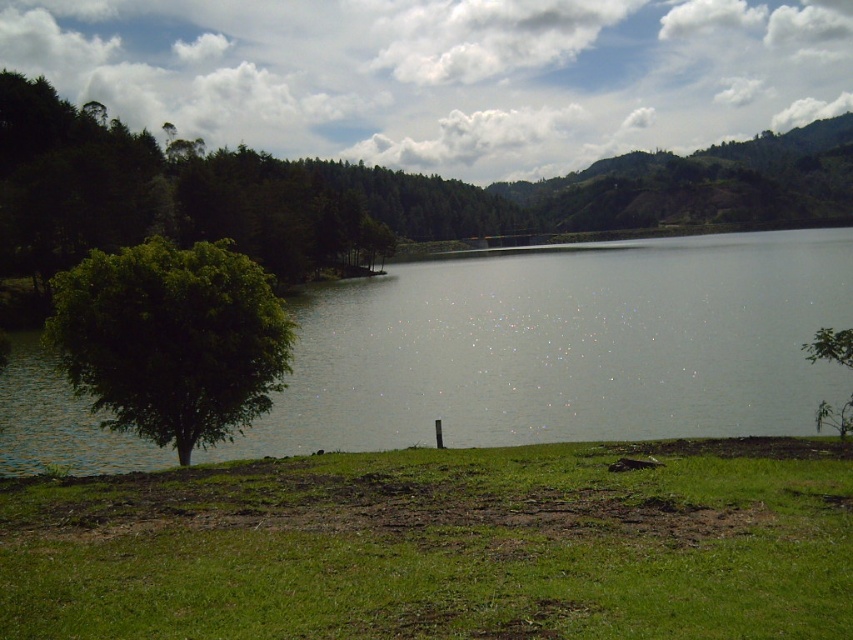
Is green leafy tree at left above green leafy tree at lower right?

Indeed, green leafy tree at left is positioned over green leafy tree at lower right.

Between green leafy tree at left and green leafy tree at lower right, which one has more height?

With more height is green leafy tree at left.

Looking at this image, who is more forward, (254, 358) or (825, 360)?

Point (825, 360) is more forward.

At what (x,y) coordinates should I click in order to perform the action: click on green leafy tree at left. Please return your answer as a coordinate pair (x, y). This screenshot has height=640, width=853. Looking at the image, I should click on (171, 340).

In the scene shown: Is green grassy at lower center to the right of green leafy tree at left from the viewer's perspective?

Correct, you'll find green grassy at lower center to the right of green leafy tree at left.

Does green grassy at lower center appear under green leafy tree at left?

Correct, green grassy at lower center is located below green leafy tree at left.

Is point (175, 499) farther from camera compared to point (102, 273)?

No, it is in front of (102, 273).

The height and width of the screenshot is (640, 853). In order to click on green grassy at lower center in this screenshot , I will do `click(440, 545)`.

Who is positioned more to the left, greenish water at center or green leafy tree at left?

From the viewer's perspective, green leafy tree at left appears more on the left side.

Looking at this image, which of these two, greenish water at center or green leafy tree at left, stands taller?

Standing taller between the two is greenish water at center.

The image size is (853, 640). I want to click on greenish water at center, so click(x=566, y=346).